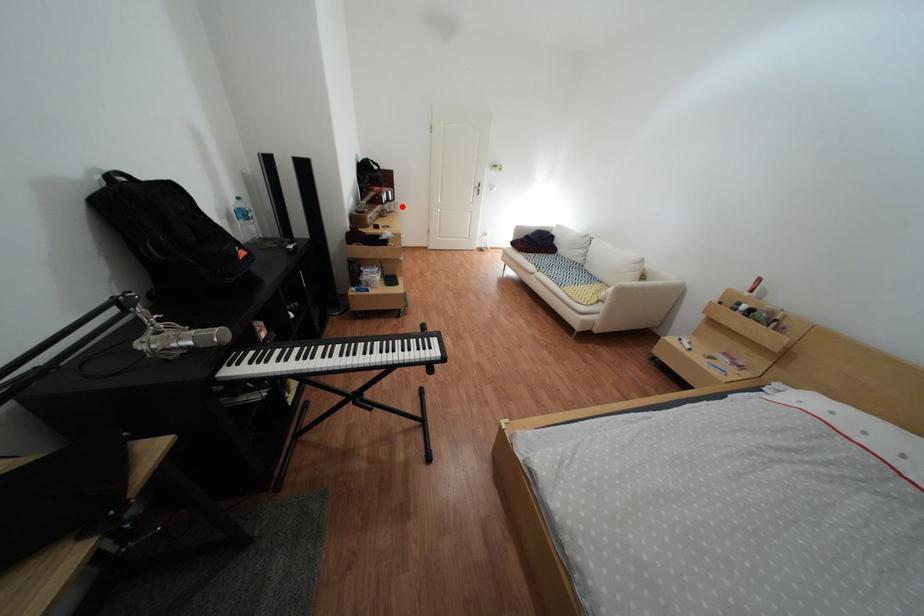
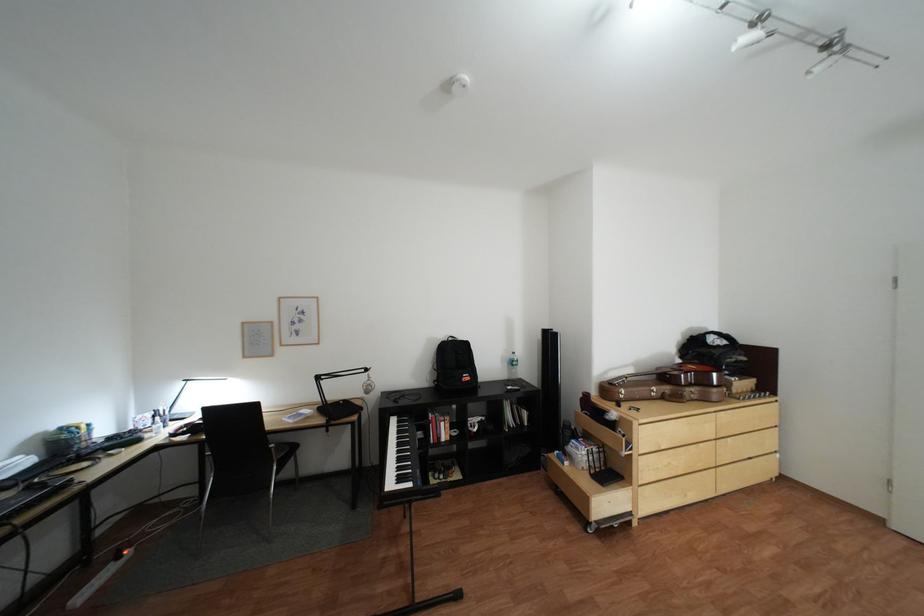
Question: I am providing you with two images of the same scene from different viewpoints. A red point is shown in image1. For the corresponding object point in image2, is it positioned nearer or farther from the camera?

Choices:
 (A) Nearer
 (B) Farther

Answer: (B)